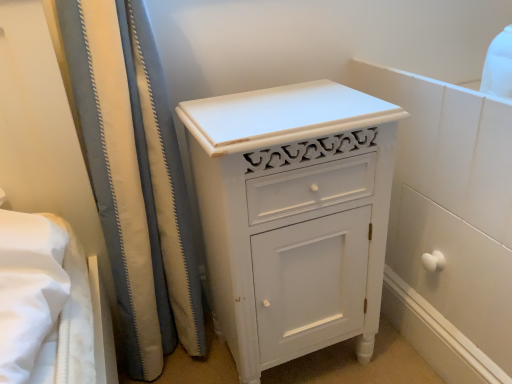
What are the coordinates of `white fabric shower curtain at left` in the screenshot? It's located at (134, 176).

Describe the element at coordinates (134, 176) in the screenshot. I see `white fabric shower curtain at left` at that location.

The width and height of the screenshot is (512, 384). In order to click on white painted wood cabinet at center in this screenshot , I will do `click(293, 216)`.

What do you see at coordinates (293, 216) in the screenshot? Image resolution: width=512 pixels, height=384 pixels. I see `white painted wood cabinet at center` at bounding box center [293, 216].

Where is `white fabric shower curtain at left`? The width and height of the screenshot is (512, 384). white fabric shower curtain at left is located at coordinates (134, 176).

Is white fabric shower curtain at left at the left side of white painted wood cabinet at center?

Yes.

Considering their positions, is white fabric shower curtain at left located in front of or behind white painted wood cabinet at center?

Visually, white fabric shower curtain at left is located in front of white painted wood cabinet at center.

Does point (153, 141) come in front of point (342, 288)?

Yes.

From the image's perspective, is white fabric shower curtain at left above white painted wood cabinet at center?

Yes, from the image's perspective, white fabric shower curtain at left is on top of white painted wood cabinet at center.

From a real-world perspective, who is located higher, white fabric shower curtain at left or white painted wood cabinet at center?

white fabric shower curtain at left is physically above.

Which object is wider, white fabric shower curtain at left or white painted wood cabinet at center?

Wider between the two is white painted wood cabinet at center.

In terms of height, does white fabric shower curtain at left look taller or shorter compared to white painted wood cabinet at center?

In the image, white fabric shower curtain at left appears to be taller than white painted wood cabinet at center.

Which of these two, white fabric shower curtain at left or white painted wood cabinet at center, is smaller?

With smaller size is white painted wood cabinet at center.

Can white painted wood cabinet at center be found inside white fabric shower curtain at left?

No, white painted wood cabinet at center is located outside of white fabric shower curtain at left.

Is white fabric shower curtain at left directly adjacent to white painted wood cabinet at center?

white fabric shower curtain at left and white painted wood cabinet at center are not in contact.

Is white painted wood cabinet at center at the back of white fabric shower curtain at left?

No.

Can you tell me how much white fabric shower curtain at left and white painted wood cabinet at center differ in facing direction?

1.68 degrees.

How distant is white fabric shower curtain at left from white painted wood cabinet at center?

white fabric shower curtain at left and white painted wood cabinet at center are 25.18 centimeters apart.

I want to click on the chest of drawers directly beneath the white fabric shower curtain at left (from a real-world perspective), so click(x=293, y=216).

Which object is positioned more to the right, white painted wood cabinet at center or white fabric shower curtain at left?

white painted wood cabinet at center is more to the right.

Based on the photo, does white painted wood cabinet at center lie in front of white fabric shower curtain at left?

No.

Is point (346, 94) closer or farther from the camera than point (150, 149)?

Point (346, 94) appears to be closer to the viewer than point (150, 149).

From the image's perspective, would you say white painted wood cabinet at center is shown under white fabric shower curtain at left?

Yes.

From a real-world perspective, is white painted wood cabinet at center located beneath white fabric shower curtain at left?

Yes.

Considering the sizes of white painted wood cabinet at center and white fabric shower curtain at left in the image, is white painted wood cabinet at center wider or thinner than white fabric shower curtain at left?

white painted wood cabinet at center is wider than white fabric shower curtain at left.

From their relative heights in the image, would you say white painted wood cabinet at center is taller or shorter than white fabric shower curtain at left?

Clearly, white painted wood cabinet at center is shorter compared to white fabric shower curtain at left.

Based on their sizes in the image, would you say white painted wood cabinet at center is bigger or smaller than white fabric shower curtain at left?

In the image, white painted wood cabinet at center appears to be smaller than white fabric shower curtain at left.

Can white fabric shower curtain at left be found inside white painted wood cabinet at center?

No, white fabric shower curtain at left is not inside white painted wood cabinet at center.

Is white painted wood cabinet at center with white fabric shower curtain at left?

No, white painted wood cabinet at center is not in contact with white fabric shower curtain at left.

Is white fabric shower curtain at left at the back of white painted wood cabinet at center?

Correct, white painted wood cabinet at center is looking away from white fabric shower curtain at left.

I want to click on the chest of drawers that is behind the white fabric shower curtain at left, so click(293, 216).

You are a GUI agent. You are given a task and a screenshot of the screen. Output one action in this format:
    pyautogui.click(x=<x>, y=<y>)
    Task: Click on the chest of drawers below the white fabric shower curtain at left (from the image's perspective)
    
    Given the screenshot: What is the action you would take?
    pyautogui.click(x=293, y=216)

Find the location of `shower curtain lying in front of the white painted wood cabinet at center`. shower curtain lying in front of the white painted wood cabinet at center is located at coordinates (134, 176).